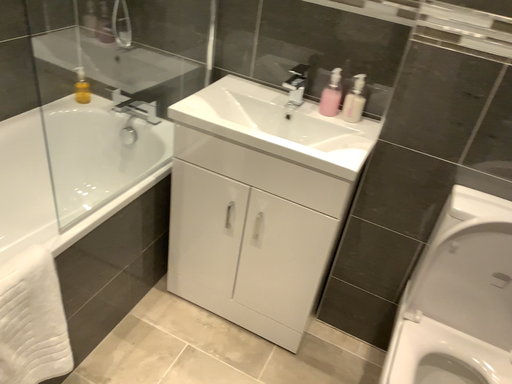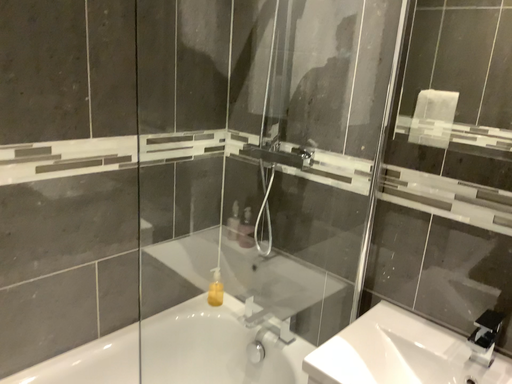
Question: Which way did the camera rotate in the video?

Choices:
 (A) rotated right
 (B) rotated left

Answer: (B)